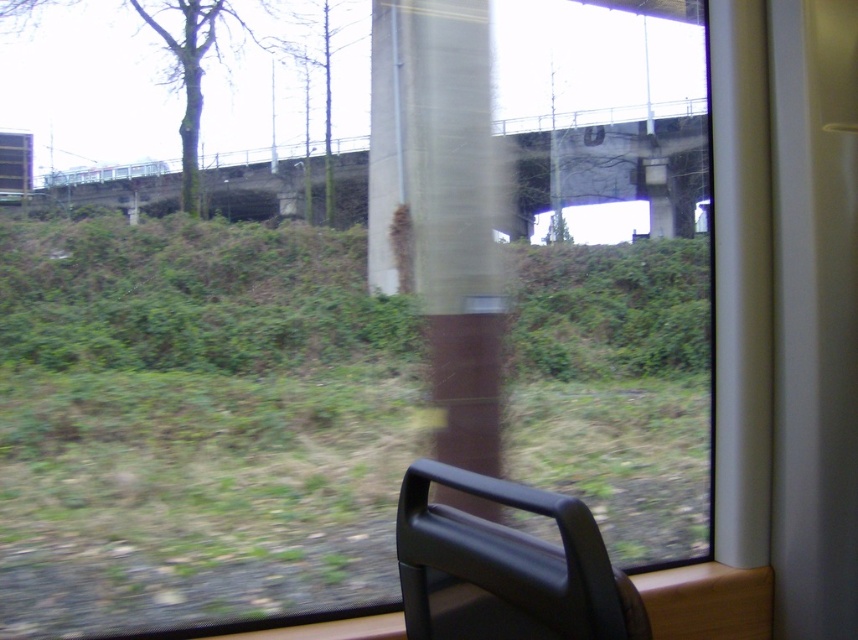
Question: Does brown textured pillar at center have a greater width compared to black matte chair at lower right?

Choices:
 (A) yes
 (B) no

Answer: (A)

Question: Which object is the farthest from the concrete bridge at center?

Choices:
 (A) brown textured pillar at center
 (B) black matte chair at lower right

Answer: (B)

Question: Can you confirm if brown textured pillar at center is bigger than concrete bridge at center?

Choices:
 (A) yes
 (B) no

Answer: (B)

Question: Which of the following is the farthest from the observer?

Choices:
 (A) concrete bridge at center
 (B) brown textured pillar at center
 (C) black matte chair at lower right

Answer: (A)

Question: Is brown textured pillar at center wider than black matte chair at lower right?

Choices:
 (A) yes
 (B) no

Answer: (A)

Question: Which object is closer to the camera taking this photo?

Choices:
 (A) brown textured pillar at center
 (B) black matte chair at lower right

Answer: (B)